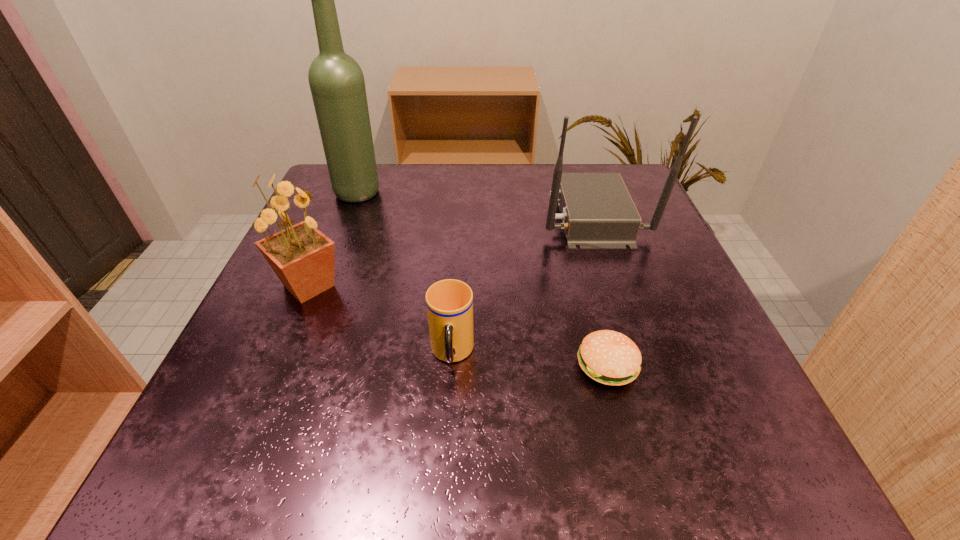
Locate an element on the screen. The width and height of the screenshot is (960, 540). wine bottle is located at coordinates (336, 81).

What are the coordinates of `router` in the screenshot? It's located at (597, 212).

The width and height of the screenshot is (960, 540). Identify the location of sunflower. (302, 257).

Where is `the third object from left to right`? The height and width of the screenshot is (540, 960). the third object from left to right is located at coordinates (449, 303).

Where is `cup`? The height and width of the screenshot is (540, 960). cup is located at coordinates (449, 303).

The height and width of the screenshot is (540, 960). Find the location of `the shortest object`. the shortest object is located at coordinates pyautogui.click(x=611, y=358).

I want to click on free space located on the right of the tallest object, so click(513, 193).

At what (x,y) coordinates should I click in order to perform the action: click on blank space located on the back of the router to connect cables. Please return your answer as a coordinate pair (x, y). The height and width of the screenshot is (540, 960). Looking at the image, I should click on (447, 216).

This screenshot has width=960, height=540. What are the coordinates of `vacant region located on the back of the router to connect cables` in the screenshot? It's located at (498, 216).

This screenshot has height=540, width=960. I want to click on free space located on the back of the router to connect cables, so click(x=381, y=216).